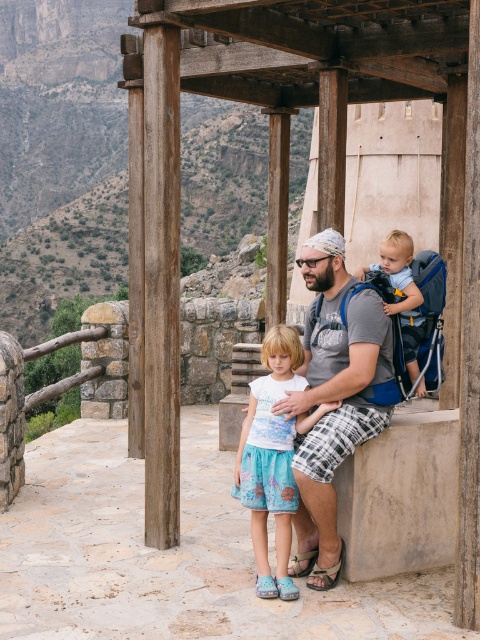
Can you confirm if light blue cotton skirt at center is taller than light blue fabric baby carrier at center?

Yes.

Can you confirm if light blue cotton skirt at center is positioned to the right of light blue fabric baby carrier at center?

In fact, light blue cotton skirt at center is to the left of light blue fabric baby carrier at center.

Between point (257, 568) and point (406, 243), which one is positioned in front?

Positioned in front is point (257, 568).

Find the location of `light blue cotton skirt at center`. light blue cotton skirt at center is located at coordinates (273, 458).

Based on the photo, does gray fabric shirt at center have a smaller size compared to light blue fabric baby carrier at center?

Actually, gray fabric shirt at center might be larger than light blue fabric baby carrier at center.

Can you confirm if gray fabric shirt at center is positioned above light blue fabric baby carrier at center?

Actually, gray fabric shirt at center is below light blue fabric baby carrier at center.

Is point (307, 344) positioned after point (381, 244)?

No, (307, 344) is in front of (381, 244).

The image size is (480, 640). Find the location of `gray fabric shirt at center`. gray fabric shirt at center is located at coordinates (333, 397).

Is wooden gazebo at center above light blue cotton skirt at center?

Correct, wooden gazebo at center is located above light blue cotton skirt at center.

Who is positioned more to the left, wooden gazebo at center or light blue cotton skirt at center?

light blue cotton skirt at center

Describe the element at coordinates (269, 157) in the screenshot. Image resolution: width=480 pixels, height=640 pixels. I see `wooden gazebo at center` at that location.

The height and width of the screenshot is (640, 480). Find the location of `wooden gazebo at center`. wooden gazebo at center is located at coordinates (269, 157).